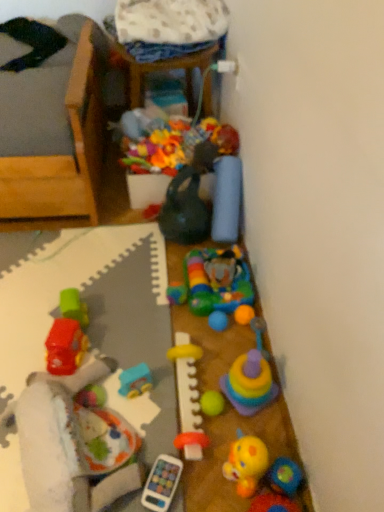
At what (x,y) coordinates should I click in order to perform the action: click on free location to the left of rubberized plastic elephant at center, marked as the 6th toy in a right-to-left arrangement. Please return your answer as a coordinate pair (x, y). Looking at the image, I should click on (153, 286).